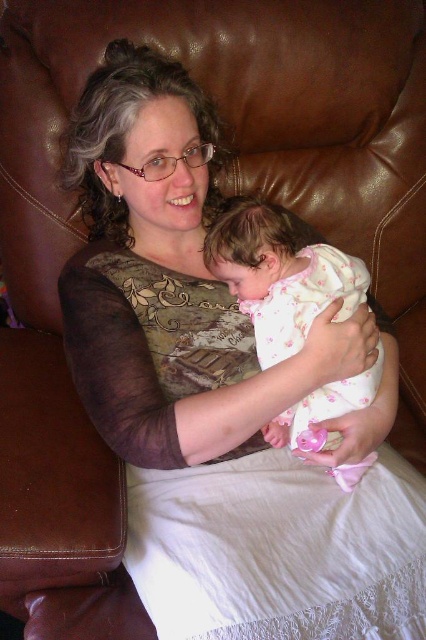
You are a photographer setting up for a portrait. You need to ensure that the matte brown dress at center and the white floral fabric baby at center are in focus simultaneously. Given that your camera has a depth of field of 4 inches, will both objects be in focus?

The matte brown dress at center is 4.26 inches from the white floral fabric baby at center. Since the depth of field is 4 inches, the distance between them exceeds the depth of field, so both objects cannot be in focus at the same time.

You are a photographer setting up a shoot in a studio. You have a matte brown dress at center and a white floral fabric baby at center in the scene. You need to place a backdrop that is 1 meter wide. Will the backdrop need to be wider than the combined width of both objects to ensure they are fully visible?

The matte brown dress at center might be wider than white floral fabric baby at center. Since the exact widths are not provided, but the description states the dress might be wider, it is safer to assume the backdrop should be wider than the combined width to ensure both are fully visible.

You are a photographer standing at point (210, 445). You want to take a photo of the woman and the baby. Can you fit both of them in the frame?

The distance between you and the woman and baby is 34.38 inches. Since you are at point (210, 445), you can adjust your position to ensure both the woman and the baby are within the camera frame.